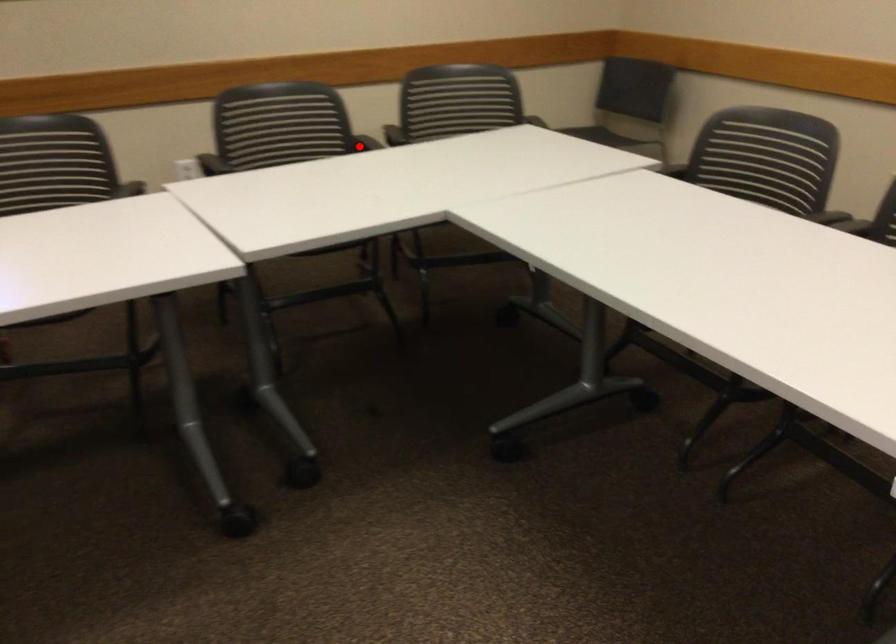
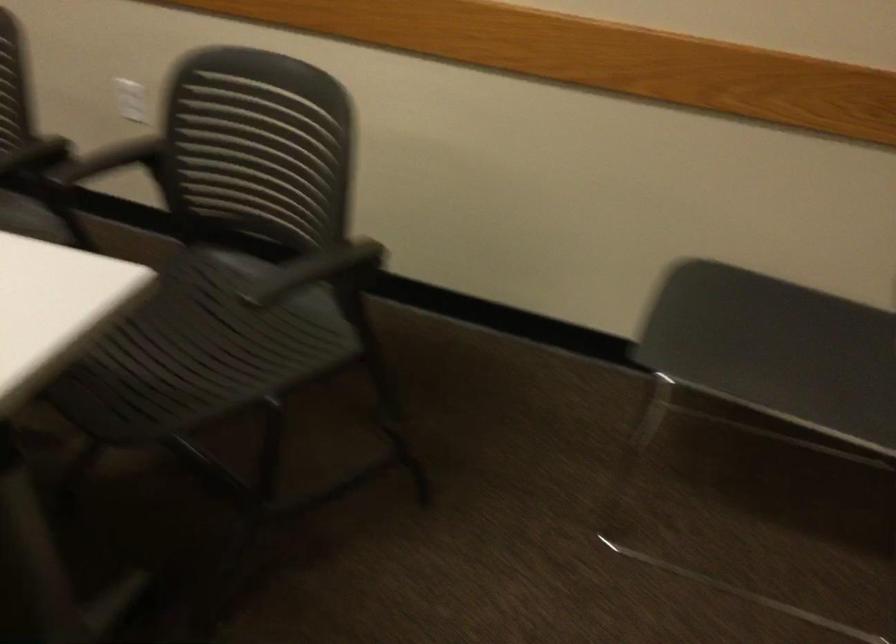
Question: I am providing you with two images of the same scene from different viewpoints. A red point is shown in image1. For the corresponding object point in image2, is it positioned nearer or farther from the camera?

Choices:
 (A) Nearer
 (B) Farther

Answer: (A)